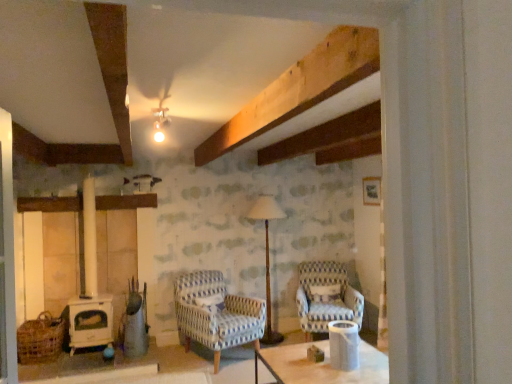
Where is `blue and white woven fabric armchair at center, which ranks as the 2th chair in right-to-left order`? Image resolution: width=512 pixels, height=384 pixels. blue and white woven fabric armchair at center, which ranks as the 2th chair in right-to-left order is located at coordinates (216, 314).

What do you see at coordinates (40, 339) in the screenshot?
I see `woven brown basket at lower left` at bounding box center [40, 339].

This screenshot has width=512, height=384. I want to click on woven brown basket at lower left, so click(40, 339).

The height and width of the screenshot is (384, 512). What do you see at coordinates (344, 345) in the screenshot? I see `white glossy cylindrical container at center` at bounding box center [344, 345].

In order to click on blue and white striped fabric armchair at center-right, positioned as the 2th chair in left-to-right order in this screenshot , I will do [x=326, y=297].

Looking at this image, would you say woven brown basket at lower left is inside or outside blue and white striped fabric armchair at center-right, which appears as the 1th chair when viewed from the right?

woven brown basket at lower left is located beyond the bounds of blue and white striped fabric armchair at center-right, which appears as the 1th chair when viewed from the right.

From a real-world perspective, which object stands above the other?

blue and white striped fabric armchair at center-right, positioned as the 2th chair in left-to-right order.

Would you consider woven brown basket at lower left to be distant from blue and white striped fabric armchair at center-right, which appears as the 1th chair when viewed from the right?

Yes, woven brown basket at lower left and blue and white striped fabric armchair at center-right, which appears as the 1th chair when viewed from the right, are quite far apart.

Does woven brown basket at lower left appear on the right side of wooden floor lamp at center?

No.

Locate an element on the screen. The height and width of the screenshot is (384, 512). basket on the left of wooden floor lamp at center is located at coordinates (40, 339).

Can you confirm if woven brown basket at lower left is taller than wooden floor lamp at center?

No, woven brown basket at lower left is not taller than wooden floor lamp at center.

From the image's perspective, is woven brown basket at lower left on wooden floor lamp at center?

No, from the image's perspective, woven brown basket at lower left is not over wooden floor lamp at center.

Could you tell me if white glossy cylindrical container at center is facing wooden floor lamp at center?

No, white glossy cylindrical container at center does not turn towards wooden floor lamp at center.

Can we say white glossy cylindrical container at center lies outside wooden floor lamp at center?

Yes, white glossy cylindrical container at center is not within wooden floor lamp at center.

Based on the photo, does white glossy cylindrical container at center lie behind wooden floor lamp at center?

No, white glossy cylindrical container at center is closer to the camera.

What's the angular difference between blue and white striped fabric armchair at center-right, which appears as the 1th chair when viewed from the right, and white glossy cylindrical container at center's facing directions?

The angle between the facing direction of blue and white striped fabric armchair at center-right, which appears as the 1th chair when viewed from the right, and the facing direction of white glossy cylindrical container at center is 68 degrees.

Considering the relative sizes of blue and white striped fabric armchair at center-right, which appears as the 1th chair when viewed from the right, and white glossy cylindrical container at center in the image provided, is blue and white striped fabric armchair at center-right, which appears as the 1th chair when viewed from the right, taller than white glossy cylindrical container at center?

Yes, blue and white striped fabric armchair at center-right, which appears as the 1th chair when viewed from the right, is taller than white glossy cylindrical container at center.

Could you tell me if blue and white striped fabric armchair at center-right, which appears as the 1th chair when viewed from the right, is turned towards white glossy cylindrical container at center?

Yes, blue and white striped fabric armchair at center-right, which appears as the 1th chair when viewed from the right, faces towards white glossy cylindrical container at center.

From a real-world perspective, is blue and white striped fabric armchair at center-right, positioned as the 2th chair in left-to-right order, physically located above or below white glossy cylindrical container at center?

blue and white striped fabric armchair at center-right, positioned as the 2th chair in left-to-right order, is below white glossy cylindrical container at center.

From the image's perspective, is woven brown basket at lower left located above white glossy cylindrical container at center?

No, from the image's perspective, woven brown basket at lower left is not above white glossy cylindrical container at center.

Is woven brown basket at lower left at the left side of white glossy cylindrical container at center?

Yes.

Considering their positions, is woven brown basket at lower left located in front of or behind white glossy cylindrical container at center?

woven brown basket at lower left is positioned farther from the viewer than white glossy cylindrical container at center.

Choose the correct answer: Is woven brown basket at lower left inside white glossy cylindrical container at center or outside it?

woven brown basket at lower left is not inside white glossy cylindrical container at center, it's outside.

This screenshot has height=384, width=512. I want to click on the 2nd chair above the woven brown basket at lower left (from the image's perspective), so click(326, 297).

In the scene shown: How distant is blue and white striped fabric armchair at center-right, positioned as the 2th chair in left-to-right order, from woven brown basket at lower left?

blue and white striped fabric armchair at center-right, positioned as the 2th chair in left-to-right order, is 2.83 meters away from woven brown basket at lower left.

Can you confirm if blue and white striped fabric armchair at center-right, positioned as the 2th chair in left-to-right order, is smaller than woven brown basket at lower left?

No, blue and white striped fabric armchair at center-right, positioned as the 2th chair in left-to-right order, is not smaller than woven brown basket at lower left.

Is the position of blue and white striped fabric armchair at center-right, positioned as the 2th chair in left-to-right order, less distant than that of woven brown basket at lower left?

No, blue and white striped fabric armchair at center-right, positioned as the 2th chair in left-to-right order, is further to the viewer.

Considering the relative sizes of wooden floor lamp at center and white glossy cylindrical container at center in the image provided, is wooden floor lamp at center thinner than white glossy cylindrical container at center?

No, wooden floor lamp at center is not thinner than white glossy cylindrical container at center.

From a real-world perspective, which object stands above the other?

In real-world perspective, wooden floor lamp at center is above.

From the picture: Who is taller, wooden floor lamp at center or white glossy cylindrical container at center?

With more height is wooden floor lamp at center.

Considering the relative sizes of wooden floor lamp at center and white glossy cylindrical container at center in the image provided, is wooden floor lamp at center bigger than white glossy cylindrical container at center?

Correct, wooden floor lamp at center is larger in size than white glossy cylindrical container at center.

Where is `the 2nd chair positioned above the woven brown basket at lower left (from the image's perspective)`? This screenshot has width=512, height=384. the 2nd chair positioned above the woven brown basket at lower left (from the image's perspective) is located at coordinates 326,297.

This screenshot has height=384, width=512. I want to click on basket on the left of the wooden floor lamp at center, so click(40, 339).

When comparing their distances from blue and white striped fabric armchair at center-right, which appears as the 1th chair when viewed from the right, does wooden floor lamp at center or blue and white woven fabric armchair at center, which ranks as the 2th chair in right-to-left order, seem closer?

wooden floor lamp at center.

Based on the photo, from the image, which object appears to be nearer to white glossy cylindrical container at center, blue and white woven fabric armchair at center, which ranks as the 2th chair in right-to-left order, or woven brown basket at lower left?

blue and white woven fabric armchair at center, which ranks as the 2th chair in right-to-left order, lies closer to white glossy cylindrical container at center than the other object.

Estimate the real-world distances between objects in this image. Which object is closer to blue and white woven fabric armchair at center, acting as the 1th chair starting from the left, wooden floor lamp at center or woven brown basket at lower left?

wooden floor lamp at center is closer to blue and white woven fabric armchair at center, acting as the 1th chair starting from the left.

Based on their spatial positions, is blue and white woven fabric armchair at center, acting as the 1th chair starting from the left, or blue and white striped fabric armchair at center-right, positioned as the 2th chair in left-to-right order, closer to wooden floor lamp at center?

Among the two, blue and white striped fabric armchair at center-right, positioned as the 2th chair in left-to-right order, is located nearer to wooden floor lamp at center.

Based on the photo, which object lies nearer to the anchor point white glossy cylindrical container at center, blue and white striped fabric armchair at center-right, positioned as the 2th chair in left-to-right order, or blue and white woven fabric armchair at center, which ranks as the 2th chair in right-to-left order?

blue and white striped fabric armchair at center-right, positioned as the 2th chair in left-to-right order, is positioned closer to the anchor white glossy cylindrical container at center.

Considering their positions, is woven brown basket at lower left positioned closer to wooden floor lamp at center than blue and white woven fabric armchair at center, acting as the 1th chair starting from the left?

Based on the image, blue and white woven fabric armchair at center, acting as the 1th chair starting from the left, appears to be nearer to wooden floor lamp at center.

Estimate the real-world distances between objects in this image. Which object is further from wooden floor lamp at center, blue and white striped fabric armchair at center-right, positioned as the 2th chair in left-to-right order, or woven brown basket at lower left?

woven brown basket at lower left lies further to wooden floor lamp at center than the other object.

From the image, which object appears to be nearer to white glossy cylindrical container at center, blue and white woven fabric armchair at center, acting as the 1th chair starting from the left, or wooden floor lamp at center?

Among the two, blue and white woven fabric armchair at center, acting as the 1th chair starting from the left, is located nearer to white glossy cylindrical container at center.

Locate an element on the screen. lamp located between woven brown basket at lower left and blue and white striped fabric armchair at center-right, which appears as the 1th chair when viewed from the right, in the left-right direction is located at coordinates (267, 257).

At what (x,y) coordinates should I click in order to perform the action: click on chair between white glossy cylindrical container at center and blue and white striped fabric armchair at center-right, positioned as the 2th chair in left-to-right order, from front to back. Please return your answer as a coordinate pair (x, y). The image size is (512, 384). Looking at the image, I should click on (216, 314).

Identify the location of lamp situated between woven brown basket at lower left and white glossy cylindrical container at center from left to right. This screenshot has width=512, height=384. (267, 257).

I want to click on chair situated between woven brown basket at lower left and white glossy cylindrical container at center from left to right, so 216,314.